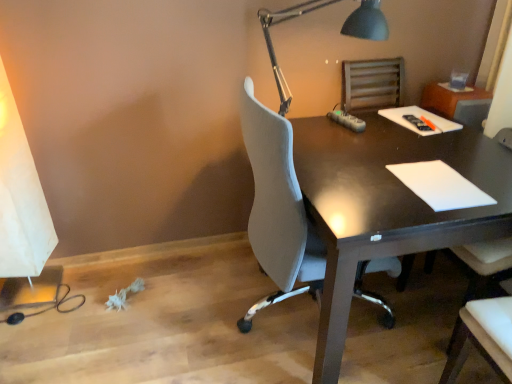
In order to face dark wood desk at center, should I rotate leftwards or rightwards?

You should rotate right by 16.979 degrees.

At what (x,y) coordinates should I click in order to perform the action: click on metallic gray desk lamp at upper right. Please return your answer as a coordinate pair (x, y). Looking at the image, I should click on click(x=272, y=43).

Is metallic gray desk lamp at upper right surrounding white matte notepad at right?

No.

Which is more to the left, metallic gray desk lamp at upper right or white matte notepad at right?

Positioned to the left is metallic gray desk lamp at upper right.

Is metallic gray desk lamp at upper right oriented towards white matte notepad at right?

Yes, metallic gray desk lamp at upper right faces towards white matte notepad at right.

Between point (377, 24) and point (401, 180), which one is positioned in front?

Point (401, 180)

Considering the sizes of objects metallic gray desk lamp at upper right and dark wood desk at center in the image provided, who is wider, metallic gray desk lamp at upper right or dark wood desk at center?

dark wood desk at center.

Which is in front, metallic gray desk lamp at upper right or dark wood desk at center?

Positioned in front is dark wood desk at center.

In the scene shown: Between metallic gray desk lamp at upper right and dark wood desk at center, which one has more height?

With more height is dark wood desk at center.

Is metallic gray desk lamp at upper right directly adjacent to dark wood desk at center?

No, metallic gray desk lamp at upper right is not with dark wood desk at center.

How many degrees apart are the facing directions of dark wood desk at center and white matte notepad at right?

dark wood desk at center and white matte notepad at right are facing 0.948 degrees away from each other.

Is dark wood desk at center touching white matte notepad at right?

dark wood desk at center is not next to white matte notepad at right, and they're not touching.

Which of these two, dark wood desk at center or white matte notepad at right, is thinner?

Thinner between the two is white matte notepad at right.

Based on their positions, is white matte notepad at right located to the left or right of dark wood desk at center?

white matte notepad at right is to the right of dark wood desk at center.

Is there a large distance between white matte notepad at right and dark wood desk at center?

Actually, white matte notepad at right and dark wood desk at center are a little close together.

From a real-world perspective, is white matte notepad at right physically located above or below dark wood desk at center?

Clearly, from a real-world perspective, white matte notepad at right is above dark wood desk at center.

Locate an element on the screen. desk on the left of white matte notepad at right is located at coordinates (386, 206).

How many degrees apart are the facing directions of white matte notepad at right and metallic gray desk lamp at upper right?

The facing directions of white matte notepad at right and metallic gray desk lamp at upper right are 3.08 degrees apart.

From the image's perspective, is white matte notepad at right located above or below metallic gray desk lamp at upper right?

white matte notepad at right is below metallic gray desk lamp at upper right.

Between white matte notepad at right and metallic gray desk lamp at upper right, which one appears on the left side from the viewer's perspective?

Positioned to the left is metallic gray desk lamp at upper right.

How much distance is there between dark wood desk at center and metallic gray desk lamp at upper right?

dark wood desk at center and metallic gray desk lamp at upper right are 26.35 inches apart.

Does point (371, 124) come in front of point (386, 23)?

That is False.

Considering the relative sizes of dark wood desk at center and metallic gray desk lamp at upper right in the image provided, is dark wood desk at center bigger than metallic gray desk lamp at upper right?

Correct, dark wood desk at center is larger in size than metallic gray desk lamp at upper right.

Considering the positions of objects dark wood desk at center and metallic gray desk lamp at upper right in the image provided, who is more to the left, dark wood desk at center or metallic gray desk lamp at upper right?

From the viewer's perspective, metallic gray desk lamp at upper right appears more on the left side.

Locate an element on the screen. The image size is (512, 384). lamp located behind the white matte notepad at right is located at coordinates (272, 43).

Identify the location of desk below the metallic gray desk lamp at upper right (from a real-world perspective). (386, 206).

Looking at the image, which one is located further to white matte notepad at right, dark wood desk at center or metallic gray desk lamp at upper right?

Among the two, metallic gray desk lamp at upper right is located further to white matte notepad at right.

Estimate the real-world distances between objects in this image. Which object is further from dark wood desk at center, white matte notepad at right or metallic gray desk lamp at upper right?

metallic gray desk lamp at upper right lies further to dark wood desk at center than the other object.

Which object lies further to the anchor point white matte notepad at right, metallic gray desk lamp at upper right or dark wood desk at center?

Among the two, metallic gray desk lamp at upper right is located further to white matte notepad at right.

From the image, which object appears to be farther from dark wood desk at center, metallic gray desk lamp at upper right or white matte notepad at right?

metallic gray desk lamp at upper right is further to dark wood desk at center.

Which object lies further to the anchor point metallic gray desk lamp at upper right, white matte notepad at right or dark wood desk at center?

white matte notepad at right is further to metallic gray desk lamp at upper right.

From the picture: Considering their positions, is dark wood desk at center positioned closer to metallic gray desk lamp at upper right than white matte notepad at right?

dark wood desk at center is positioned closer to the anchor metallic gray desk lamp at upper right.

Locate an element on the screen. This screenshot has width=512, height=384. notepad between metallic gray desk lamp at upper right and dark wood desk at center from top to bottom is located at coordinates (440, 185).